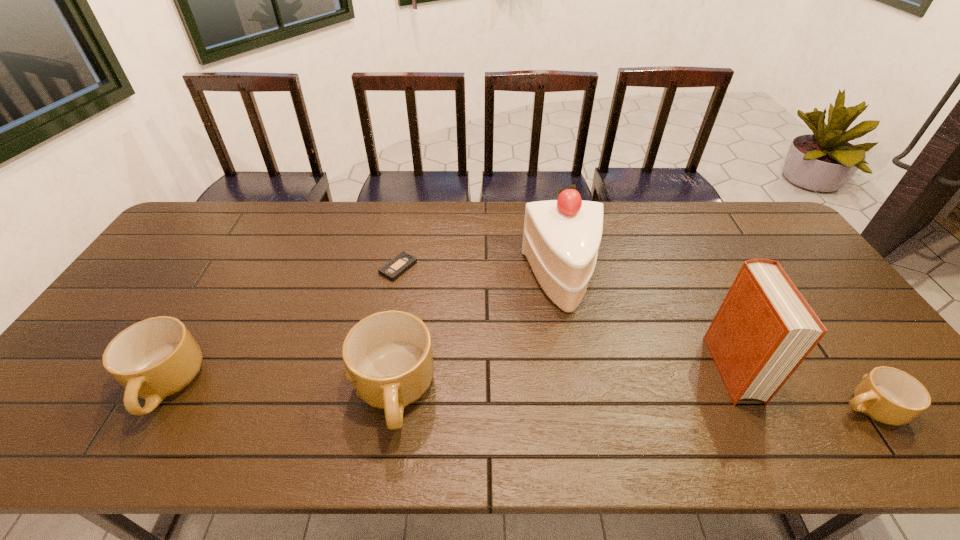
Image resolution: width=960 pixels, height=540 pixels. What are the coordinates of `the leftmost mug` in the screenshot? It's located at pyautogui.click(x=157, y=357).

Where is `the leftmost object`? This screenshot has height=540, width=960. the leftmost object is located at coordinates (157, 357).

Where is `the second mug from left to right`? the second mug from left to right is located at coordinates (388, 357).

Locate an element on the screen. This screenshot has width=960, height=540. the rightmost mug is located at coordinates (888, 395).

This screenshot has width=960, height=540. I want to click on the second shortest object, so click(888, 395).

Where is `the fourth object from left to right`? the fourth object from left to right is located at coordinates (561, 238).

This screenshot has width=960, height=540. I want to click on the shortest object, so click(403, 261).

Locate an element on the screen. The width and height of the screenshot is (960, 540). hardback book is located at coordinates (764, 329).

Where is `blank area located on the side with the handle of the rightmost mug`? blank area located on the side with the handle of the rightmost mug is located at coordinates (693, 408).

Where is `free region located 0.370m on the side with the handle of the rightmost mug`? The width and height of the screenshot is (960, 540). free region located 0.370m on the side with the handle of the rightmost mug is located at coordinates (677, 408).